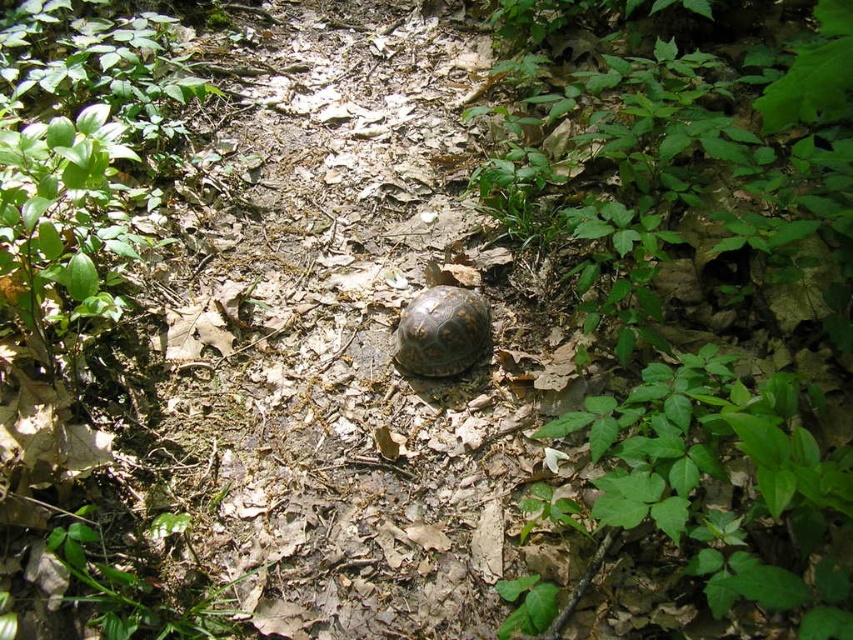
You are a small insect observing the forest floor. You see the green leafy plant at center and the brown textured tortoise at center. Which object is closer to you?

The green leafy plant at center is closer to you because it is in front of the brown textured tortoise at center.

You are a hiker who has spotted both the green leafy plant at center and the brown textured tortoise at center in the forest. Which object is closer to you, and why?

The green leafy plant at center is closer to you because it is positioned over the brown textured tortoise at center, meaning it is in front of the tortoise.